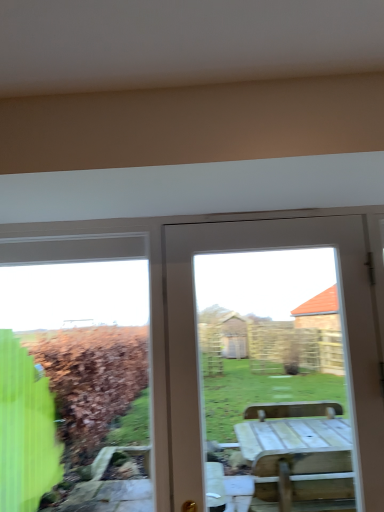
This screenshot has height=512, width=384. What are the coordinates of `free space above green glass window at left (from a real-world perspective)` in the screenshot? It's located at (74, 236).